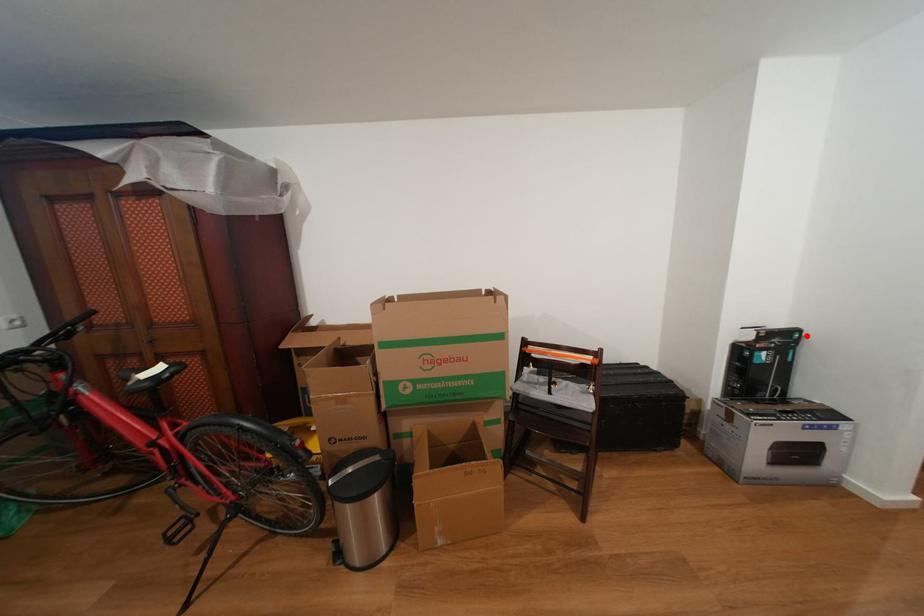
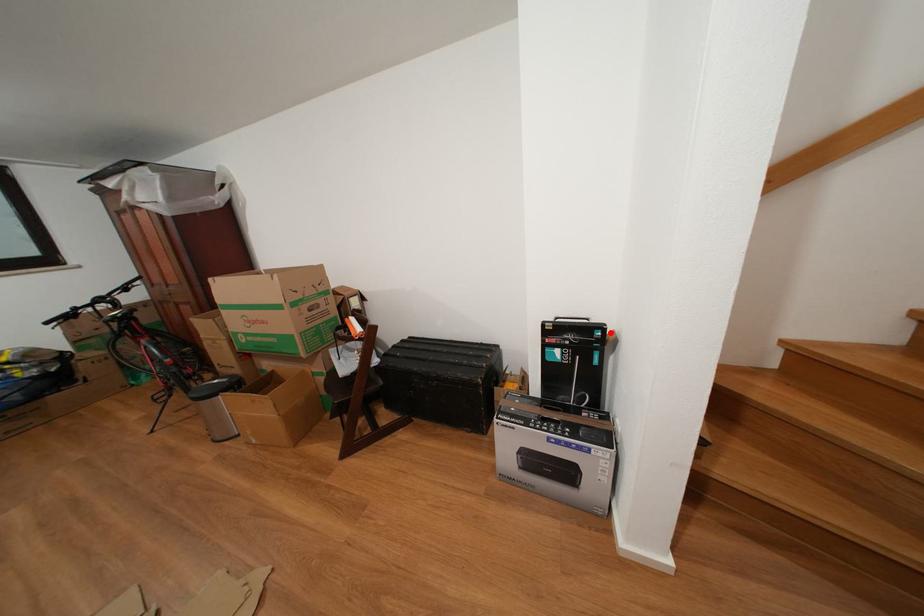
I am providing you with two images of the same scene from different viewpoints. A red point is marked on the first image and another point is marked on the second image. Do the highlighted points in image1 and image2 indicate the same real-world spot?

Yes